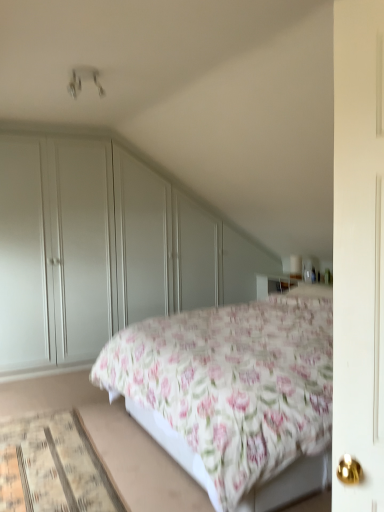
Question: Are floral cotton bed at center and beige woven mat at lower left located far from each other?

Choices:
 (A) yes
 (B) no

Answer: (B)

Question: Is floral cotton bed at center behind beige woven mat at lower left?

Choices:
 (A) yes
 (B) no

Answer: (B)

Question: Is floral cotton bed at center shorter than beige woven mat at lower left?

Choices:
 (A) yes
 (B) no

Answer: (B)

Question: Can beige woven mat at lower left be found inside floral cotton bed at center?

Choices:
 (A) yes
 (B) no

Answer: (B)

Question: From a real-world perspective, is floral cotton bed at center over beige woven mat at lower left?

Choices:
 (A) no
 (B) yes

Answer: (B)

Question: From the image's perspective, is beige woven mat at lower left located above or below matte white wardrobe at left?

Choices:
 (A) above
 (B) below

Answer: (B)

Question: From a real-world perspective, is beige woven mat at lower left physically located above or below matte white wardrobe at left?

Choices:
 (A) above
 (B) below

Answer: (B)

Question: Is beige woven mat at lower left in front of or behind matte white wardrobe at left in the image?

Choices:
 (A) front
 (B) behind

Answer: (A)

Question: Is beige woven mat at lower left taller or shorter than matte white wardrobe at left?

Choices:
 (A) short
 (B) tall

Answer: (A)

Question: In terms of size, does beige woven mat at lower left appear bigger or smaller than floral cotton bed at center?

Choices:
 (A) small
 (B) big

Answer: (A)

Question: In terms of width, does beige woven mat at lower left look wider or thinner when compared to floral cotton bed at center?

Choices:
 (A) thin
 (B) wide

Answer: (A)

Question: From their relative heights in the image, would you say beige woven mat at lower left is taller or shorter than floral cotton bed at center?

Choices:
 (A) short
 (B) tall

Answer: (A)

Question: From a real-world perspective, is beige woven mat at lower left positioned above or below floral cotton bed at center?

Choices:
 (A) above
 (B) below

Answer: (B)

Question: In terms of width, does floral cotton bed at center look wider or thinner when compared to matte white wardrobe at left?

Choices:
 (A) wide
 (B) thin

Answer: (A)

Question: In the image, is floral cotton bed at center positioned in front of or behind matte white wardrobe at left?

Choices:
 (A) behind
 (B) front

Answer: (B)